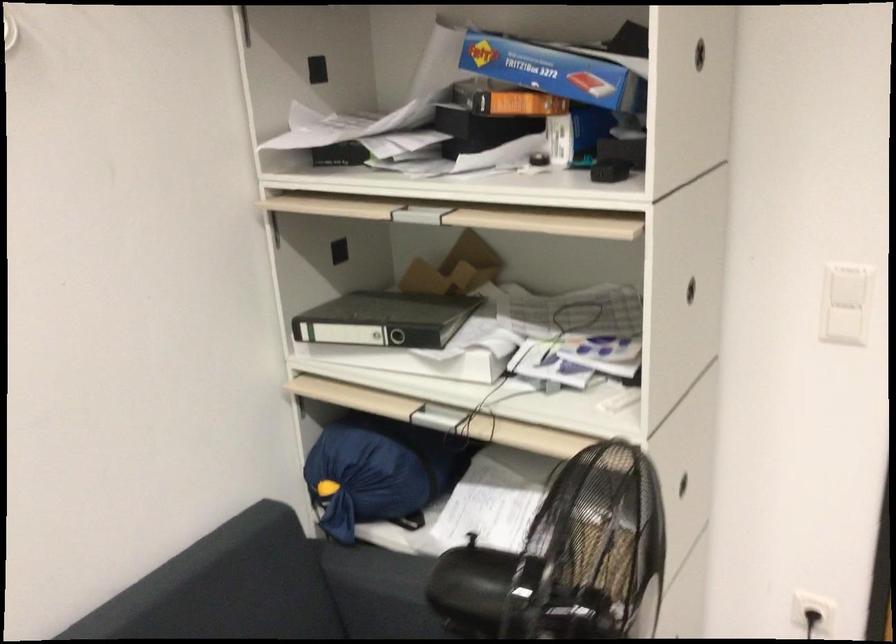
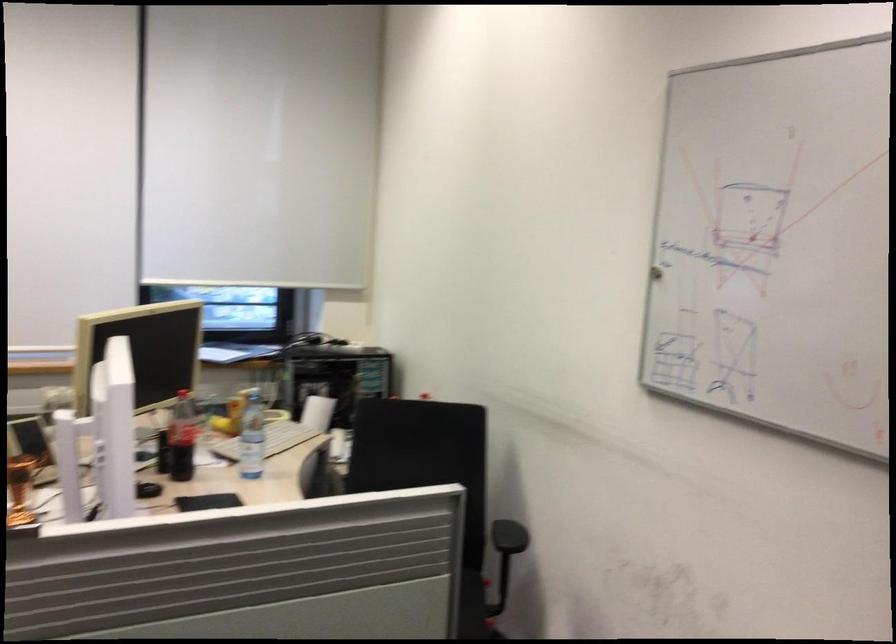
The images are taken continuously from a first-person perspective. In which direction is your viewpoint rotating?

The rotation direction of the camera is left-down.